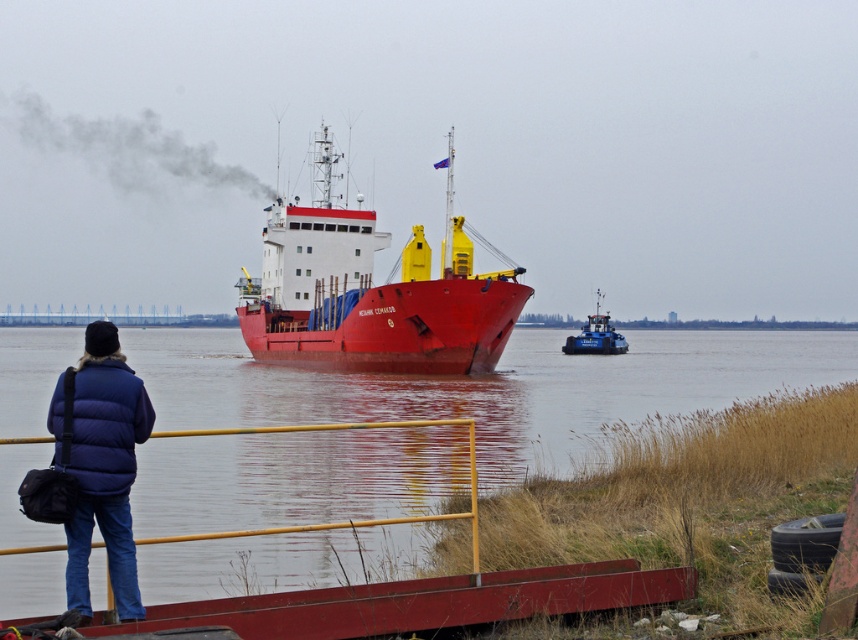
Question: Which of these objects is positioned closest to the blue metallic tugboat at center?

Choices:
 (A) red matte ship at center
 (B) yellow metal rail at lower center
 (C) smooth wood dock at lower center
 (D) blue down jacket at lower left

Answer: (A)

Question: Which of these objects is positioned closest to the smooth water at ship front?

Choices:
 (A) yellow metal rail at lower center
 (B) blue metallic tugboat at center
 (C) smooth wood dock at lower center
 (D) blue down jacket at lower left

Answer: (B)

Question: Is smooth water at ship front further to the viewer compared to blue down jacket at lower left?

Choices:
 (A) yes
 (B) no

Answer: (A)

Question: Is smooth wood dock at lower center bigger than blue metallic tugboat at center?

Choices:
 (A) no
 (B) yes

Answer: (A)

Question: Estimate the real-world distances between objects in this image. Which object is farther from the yellow metal rail at lower center?

Choices:
 (A) blue metallic tugboat at center
 (B) red matte ship at center
 (C) blue down jacket at lower left
 (D) smooth wood dock at lower center

Answer: (A)

Question: Does smooth wood dock at lower center have a lesser width compared to blue metallic tugboat at center?

Choices:
 (A) no
 (B) yes

Answer: (B)